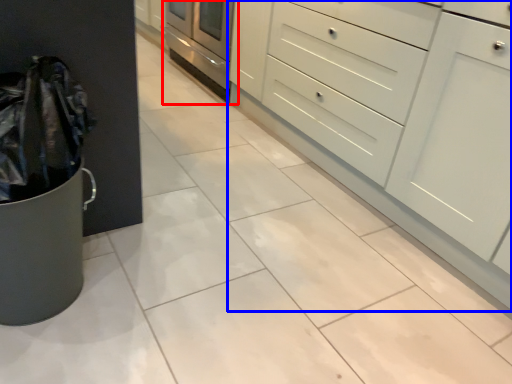
Question: Among these objects, which one is farthest to the camera, oven (highlighted by a red box) or chest of drawers (highlighted by a blue box)?

Choices:
 (A) oven
 (B) chest of drawers

Answer: (A)